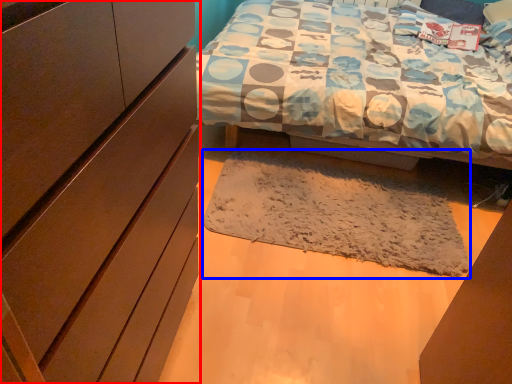
Question: Which of the following is the farthest to the observer, cabinetry (highlighted by a red box) or mat (highlighted by a blue box)?

Choices:
 (A) cabinetry
 (B) mat

Answer: (B)